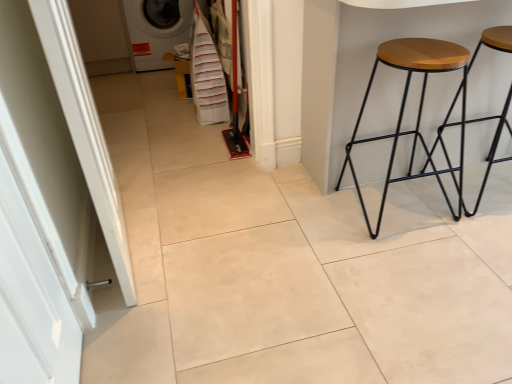
Where is `vacant space that is to the left of white fabric laundry at center`? vacant space that is to the left of white fabric laundry at center is located at coordinates (175, 112).